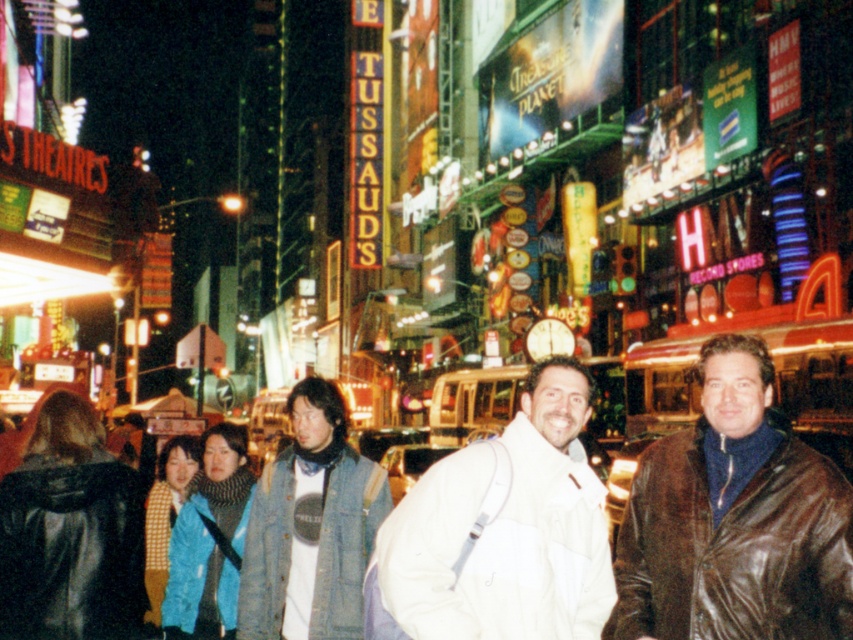
Question: Can you confirm if white matte jacket at center is positioned above denim jacket at center?

Choices:
 (A) yes
 (B) no

Answer: (B)

Question: Considering the relative positions of brown leather jacket at center and white matte jacket at center in the image provided, where is brown leather jacket at center located with respect to white matte jacket at center?

Choices:
 (A) right
 (B) left

Answer: (A)

Question: Considering the real-world distances, which object is closest to the denim jacket at center?

Choices:
 (A) brown leather jacket at center
 (B) white matte jacket at center

Answer: (B)

Question: Among these objects, which one is nearest to the camera?

Choices:
 (A) white matte jacket at center
 (B) denim jacket at center
 (C) brown leather jacket at center

Answer: (C)

Question: Does white matte jacket at center appear on the left side of denim jacket at center?

Choices:
 (A) no
 (B) yes

Answer: (A)

Question: Which object is the closest to the white matte jacket at center?

Choices:
 (A) denim jacket at center
 (B) brown leather jacket at center

Answer: (B)